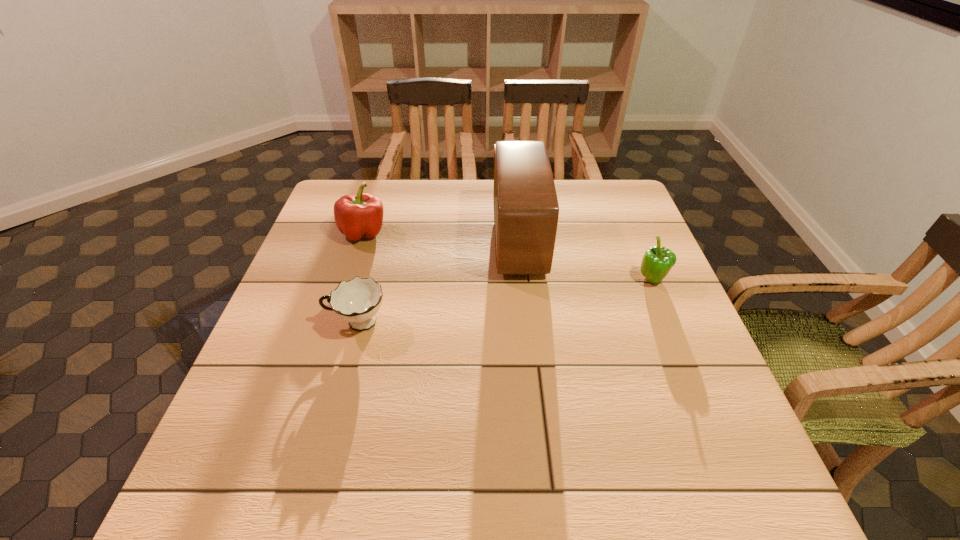
Image resolution: width=960 pixels, height=540 pixels. I want to click on free point that satisfies the following two spatial constraints: 1. on the front-facing side of the tallest object; 2. on the left side of the nearer bell pepper, so click(x=522, y=280).

Where is `vacant space that satisfies the following two spatial constraints: 1. on the front-facing side of the tallest object; 2. on the back side of the rightmost object`? The image size is (960, 540). vacant space that satisfies the following two spatial constraints: 1. on the front-facing side of the tallest object; 2. on the back side of the rightmost object is located at coordinates (522, 280).

You are a GUI agent. You are given a task and a screenshot of the screen. Output one action in this format:
    pyautogui.click(x=<x>, y=<y>)
    Task: Click on the free space that satisfies the following two spatial constraints: 1. on the front-facing side of the right bell pepper; 2. on the left side of the tallest object
    The width and height of the screenshot is (960, 540).
    Given the screenshot: What is the action you would take?
    pyautogui.click(x=522, y=280)

Where is `blank space that satisfies the following two spatial constraints: 1. on the side of the rightmost object with the handle; 2. on the right side of the cup`? This screenshot has width=960, height=540. blank space that satisfies the following two spatial constraints: 1. on the side of the rightmost object with the handle; 2. on the right side of the cup is located at coordinates (369, 280).

Identify the location of free spot that satisfies the following two spatial constraints: 1. on the front side of the left bell pepper; 2. on the side of the cup with the handle. The image size is (960, 540). (335, 323).